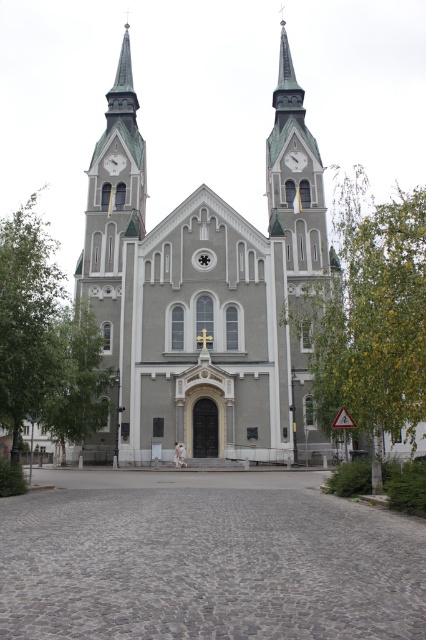
Does green leafy tree at center have a larger size compared to green leafy tree at left?

Yes.

Find the location of a particular element. green leafy tree at center is located at coordinates (370, 314).

Does gray stone church at center lie behind green textured spire at center?

No, it is not.

Which is more to the left, gray stone church at center or green textured spire at center?

gray stone church at center

This screenshot has height=640, width=426. What do you see at coordinates (204, 292) in the screenshot? I see `gray stone church at center` at bounding box center [204, 292].

The height and width of the screenshot is (640, 426). I want to click on gray stone church at center, so [x=204, y=292].

Can you confirm if green leafy tree at left is taller than white glossy clock at upper center?

Indeed, green leafy tree at left has a greater height compared to white glossy clock at upper center.

Does green leafy tree at left have a lesser width compared to white glossy clock at upper center?

Incorrect, green leafy tree at left's width is not less than white glossy clock at upper center's.

Is point (11, 280) less distant than point (296, 163)?

Yes, point (11, 280) is in front of point (296, 163).

Locate an element on the screen. green leafy tree at left is located at coordinates (45, 339).